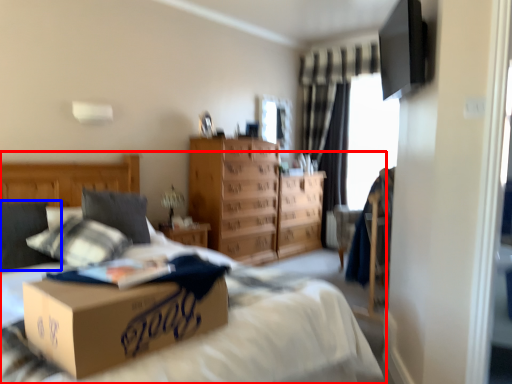
Question: Which point is closer to the camera, bed (highlighted by a red box) or pillow (highlighted by a blue box)?

Choices:
 (A) bed
 (B) pillow

Answer: (A)